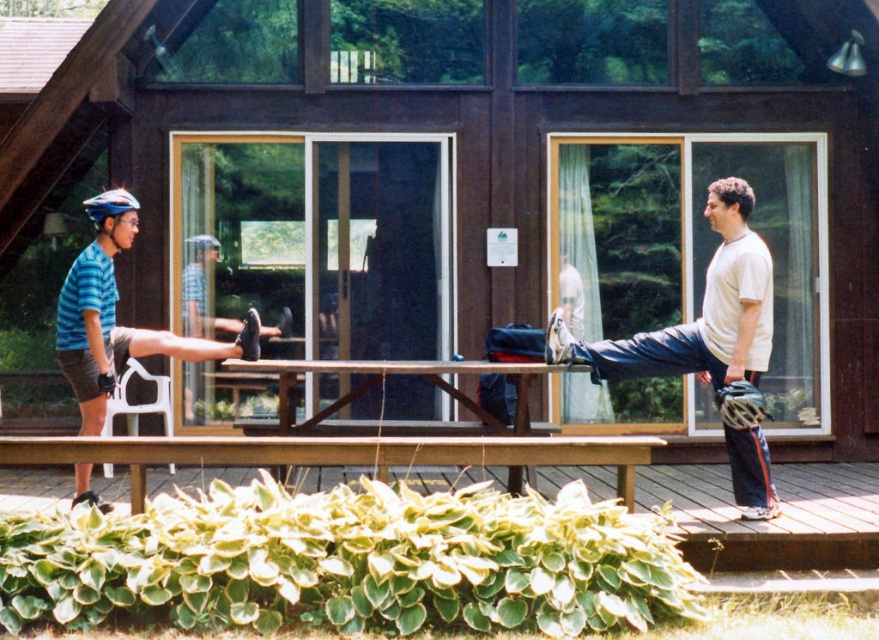
You are a skateboarder who wants to jump onto the wooden bench at lower center from the blue helmeted skateboarder at left. Can you land safely?

The wooden bench at lower center is below the blue helmeted skateboarder at left, so yes, you can jump down safely from the blue helmeted skateboarder at left to the wooden bench at lower center.

You are a delivery robot trying to navigate to the entrance of the building. The entrance is located at point (701, 310). There is a white matte helmet at upper right at that point. Can you safely pass through that point without hitting the helmet?

The entrance is located at point (701, 310) where the white matte helmet at upper right is present. Since the helmet is at that exact point, the robot cannot safely pass through that point without hitting the helmet.

You are standing on the wooden deck where the two people are stretching. You want to place a yoga mat exactly at the point marked by the coordinates point (549, 465). However, there is a wooden bench at lower center. Will the yoga mat overlap with the bench?

The point (549, 465) marks the wooden bench at lower center, so placing the yoga mat there would overlap with the bench.